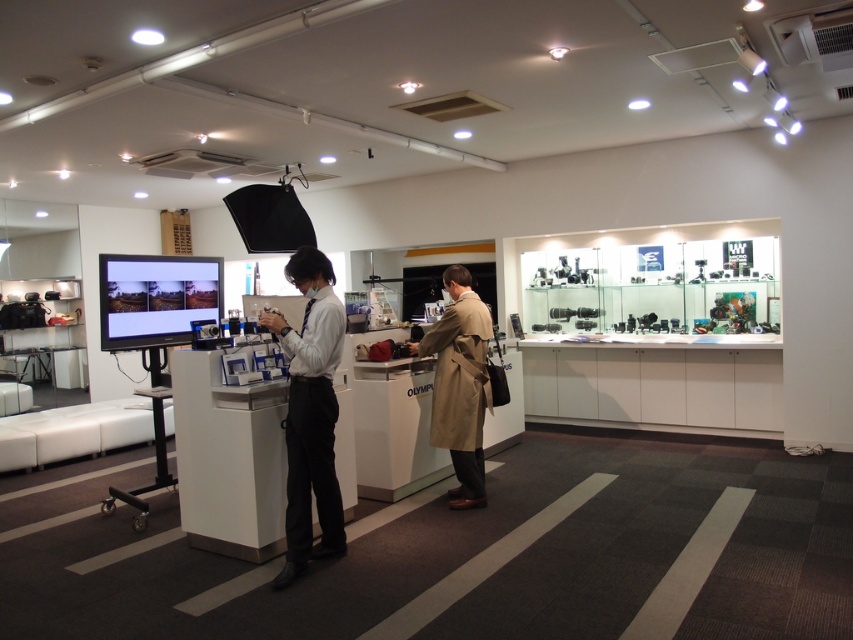
You are a customer in the camera store and want to see the large screen mounted on the display stand. There is a white shirt at center and a tan leather trench coat at center in your way. Which object should you move to get a better view of the screen?

The white shirt at center is positioned under the tan leather trench coat at center. To get a better view of the screen, you should move the tan leather trench coat at center since it is above and blocking the view.